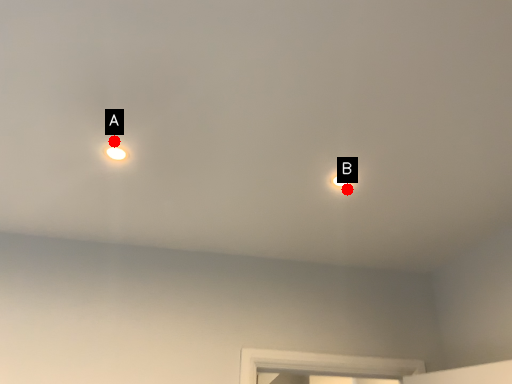
Question: Two points are circled on the image, labeled by A and B beside each circle. Which point appears farthest from the camera in this image?

Choices:
 (A) A is further
 (B) B is further

Answer: (B)